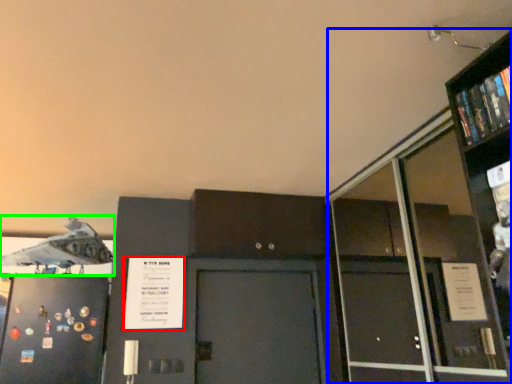
Question: Which is farther away from poster (highlighted by a red box)? bookcase (highlighted by a blue box) or airplane (highlighted by a green box)?

Choices:
 (A) bookcase
 (B) airplane

Answer: (A)